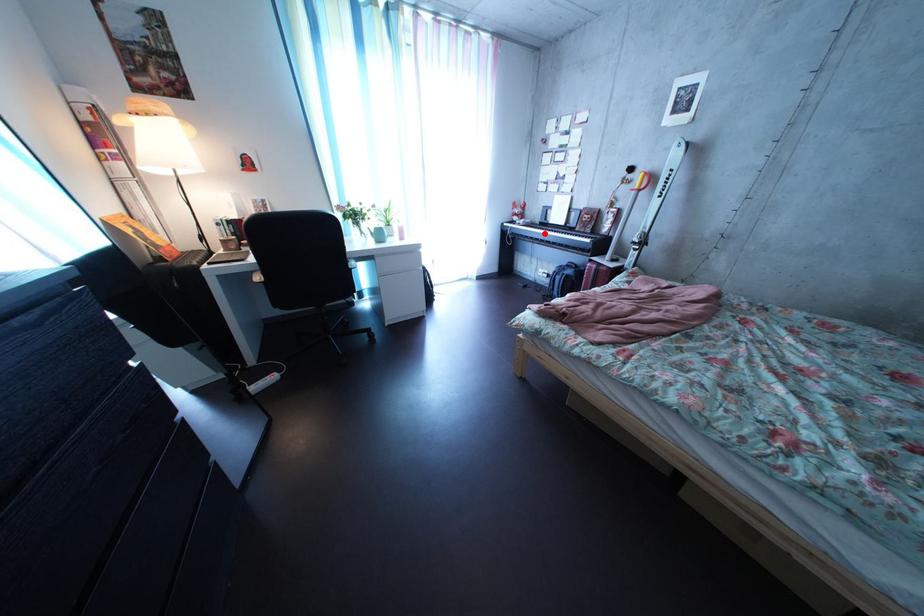
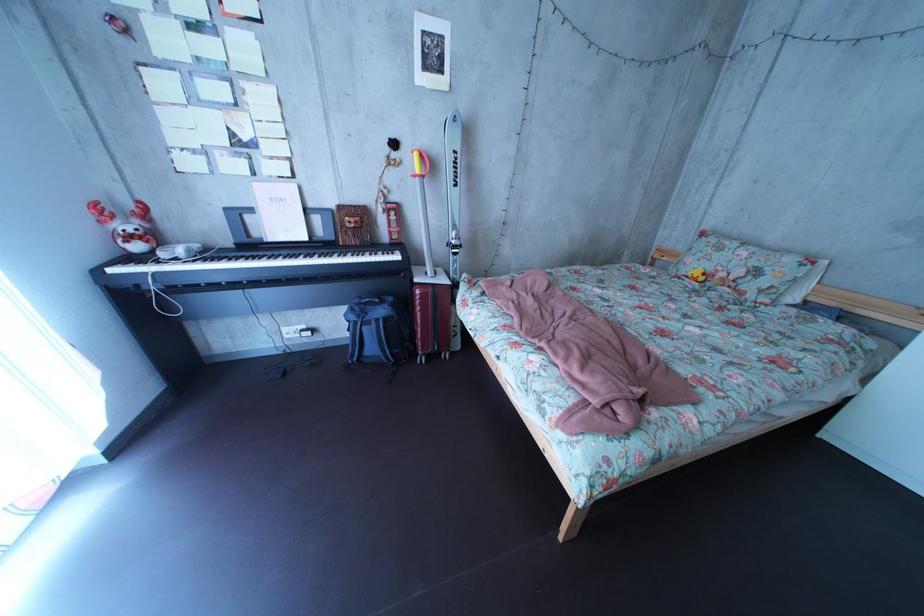
Question: I am providing you with two images of the same scene from different viewpoints. A red point is marked on the first image. Can you still see the location of the red point in image 2?

Choices:
 (A) Yes
 (B) No

Answer: (A)